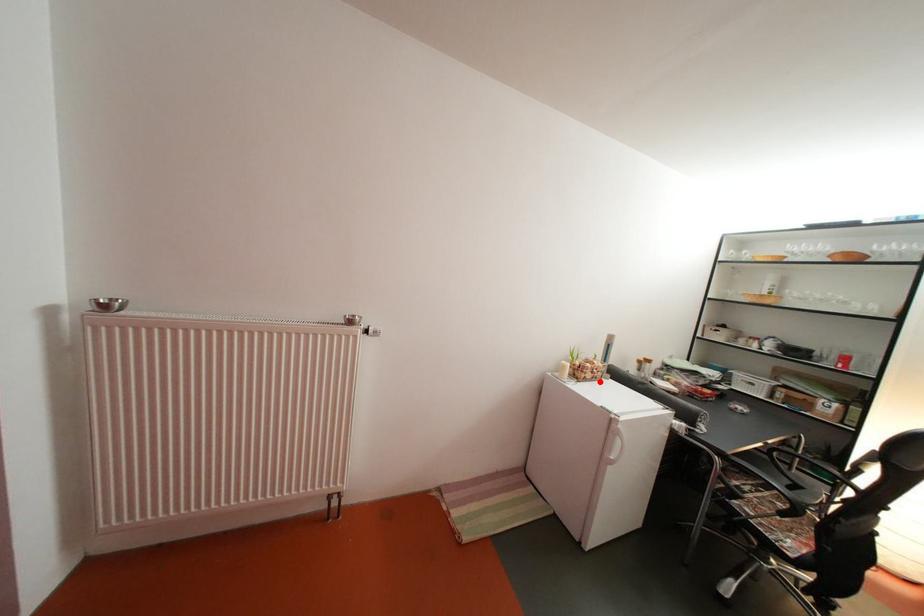
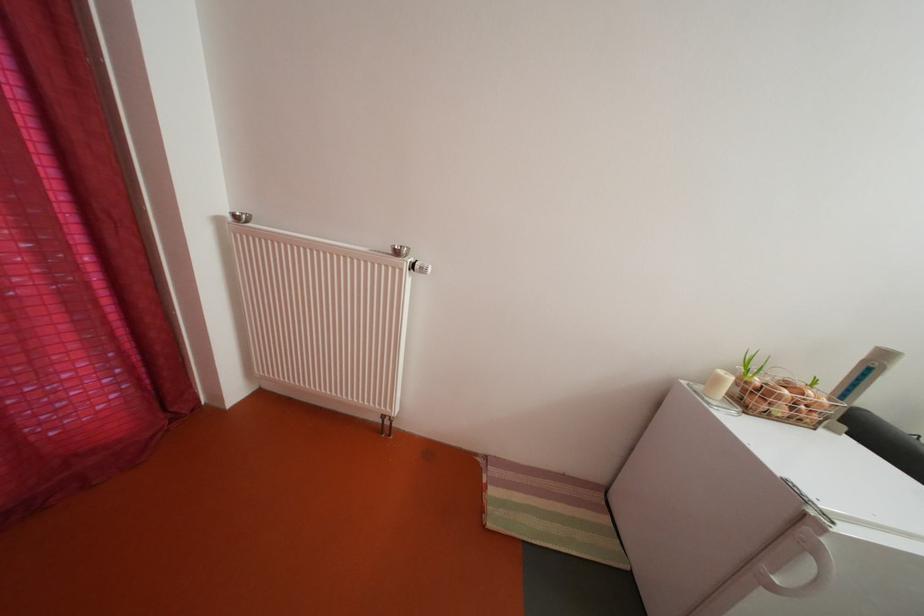
Find the pixel in the second image that matches the highlighted location in the first image.

(792, 416)